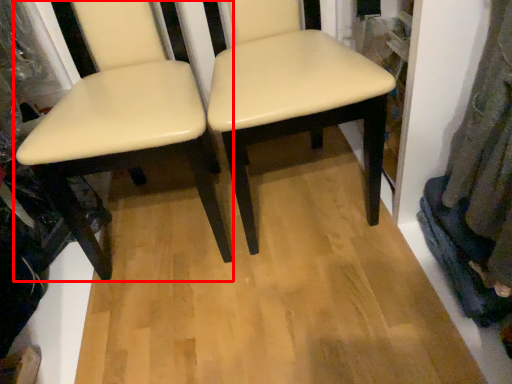
Question: From the image's perspective, considering the relative positions of chair (annotated by the red box) and chair in the image provided, where is chair (annotated by the red box) located with respect to the staircase?

Choices:
 (A) above
 (B) below

Answer: (B)